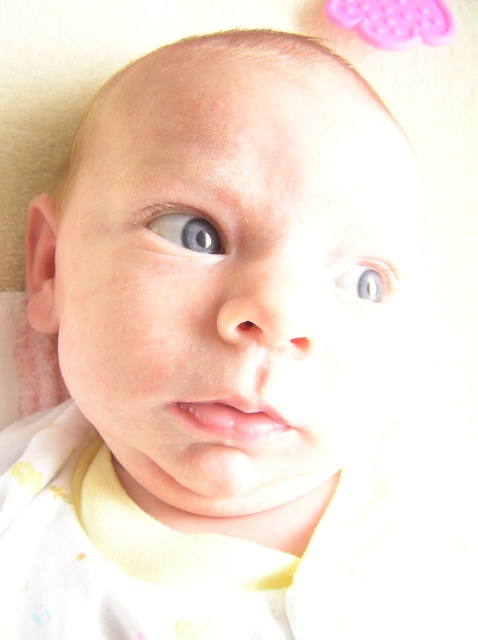
Question: Is the position of blue glossy eye at upper left more distant than that of blue glossy eye at upper center?

Choices:
 (A) yes
 (B) no

Answer: (B)

Question: Which point is closer to the camera taking this photo?

Choices:
 (A) (373, 269)
 (B) (178, 236)

Answer: (B)

Question: Which of the following is the farthest from the observer?

Choices:
 (A) blue glossy eye at upper left
 (B) blue glossy eye at upper center

Answer: (B)

Question: Which of the following is the farthest from the observer?

Choices:
 (A) blue glossy eye at upper left
 (B) blue glossy eye at upper center

Answer: (B)

Question: In this image, where is blue glossy eye at upper left located relative to blue glossy eye at upper center?

Choices:
 (A) left
 (B) right

Answer: (A)

Question: Is blue glossy eye at upper left further to camera compared to blue glossy eye at upper center?

Choices:
 (A) no
 (B) yes

Answer: (A)